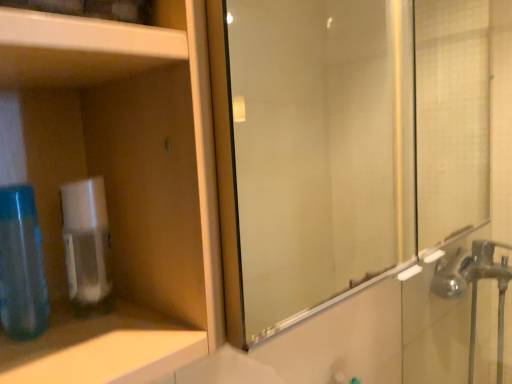
Question: Is white glossy cabinet at upper left smaller than clear plastic soap dispenser at left?

Choices:
 (A) no
 (B) yes

Answer: (A)

Question: Is clear plastic soap dispenser at left completely or partially inside white glossy cabinet at upper left?

Choices:
 (A) yes
 (B) no

Answer: (B)

Question: Is white glossy cabinet at upper left thinner than clear plastic soap dispenser at left?

Choices:
 (A) no
 (B) yes

Answer: (A)

Question: Is white glossy cabinet at upper left taller than clear plastic soap dispenser at left?

Choices:
 (A) yes
 (B) no

Answer: (A)

Question: Would you say white glossy cabinet at upper left is a long distance from clear plastic soap dispenser at left?

Choices:
 (A) yes
 (B) no

Answer: (B)

Question: Looking at their shapes, would you say clear plastic soap dispenser at left is wider or thinner than silver metallic faucet at right?

Choices:
 (A) wide
 (B) thin

Answer: (B)

Question: Is clear plastic soap dispenser at left in front of or behind silver metallic faucet at right in the image?

Choices:
 (A) front
 (B) behind

Answer: (A)

Question: In terms of height, does clear plastic soap dispenser at left look taller or shorter compared to silver metallic faucet at right?

Choices:
 (A) tall
 (B) short

Answer: (B)

Question: Is clear plastic soap dispenser at left spatially inside silver metallic faucet at right, or outside of it?

Choices:
 (A) outside
 (B) inside

Answer: (A)

Question: Visually, is white glossy cabinet at upper left positioned to the left or to the right of silver metallic faucet at right?

Choices:
 (A) right
 (B) left

Answer: (B)

Question: Does point (91, 76) appear closer or farther from the camera than point (472, 380)?

Choices:
 (A) farther
 (B) closer

Answer: (B)

Question: In terms of height, does white glossy cabinet at upper left look taller or shorter compared to silver metallic faucet at right?

Choices:
 (A) short
 (B) tall

Answer: (A)

Question: From a real-world perspective, relative to silver metallic faucet at right, is white glossy cabinet at upper left vertically above or below?

Choices:
 (A) above
 (B) below

Answer: (A)

Question: Is silver metallic faucet at right bigger or smaller than matte plastic cabinet at left?

Choices:
 (A) big
 (B) small

Answer: (A)

Question: Is silver metallic faucet at right in front of or behind matte plastic cabinet at left in the image?

Choices:
 (A) behind
 (B) front

Answer: (A)